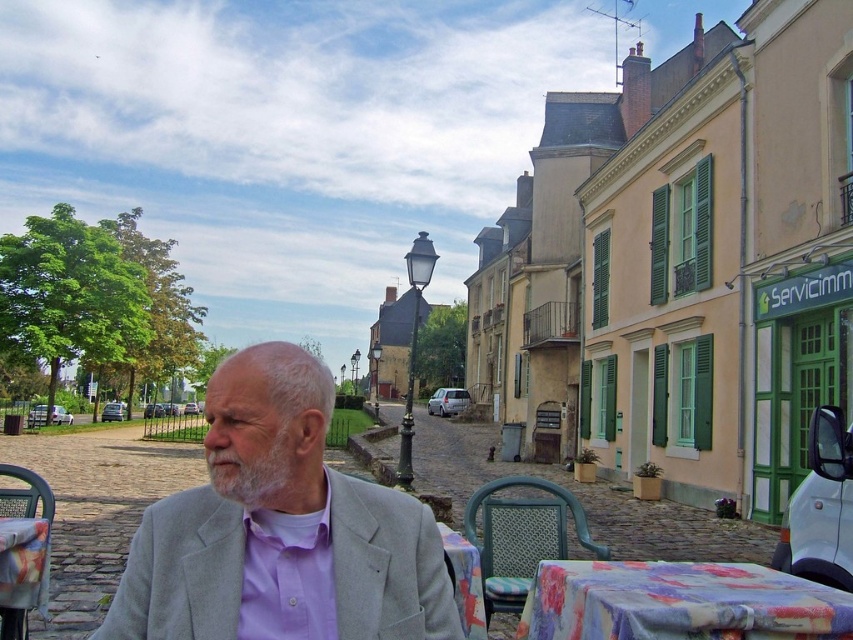
Does woven plastic chair at lower center appear over grayhairbeard at center?

Actually, woven plastic chair at lower center is below grayhairbeard at center.

Is point (532, 557) farther from viewer compared to point (292, 468)?

Yes, point (532, 557) is behind point (292, 468).

Between point (515, 512) and point (293, 468), which one is positioned in front?

Positioned in front is point (293, 468).

Locate an element on the screen. The image size is (853, 640). woven plastic chair at lower center is located at coordinates (521, 536).

Can you confirm if gray woolen suit at center is wider than floral printed fabric at lower right?

Yes.

Measure the distance between point (450, 602) and camera.

Point (450, 602) and camera are 8.90 feet apart.

Between point (225, 492) and point (740, 630), which one is positioned behind?

Point (740, 630)

Identify the location of gray woolen suit at center. This screenshot has height=640, width=853. (280, 529).

Which is in front, point (267, 600) or point (18, 492)?

Point (267, 600) is in front.

This screenshot has width=853, height=640. In order to click on purple cotton shirt at center in this screenshot , I will do `click(287, 576)`.